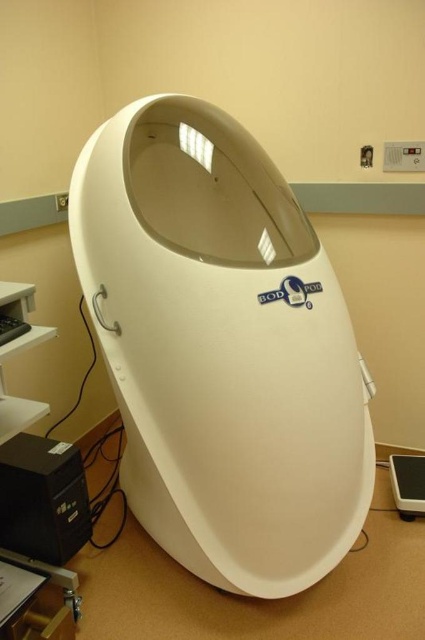
Question: Is white plastic pod at center behind black plastic mouse at lower left?

Choices:
 (A) no
 (B) yes

Answer: (B)

Question: Which point is farther from the camera taking this photo?

Choices:
 (A) (144, 508)
 (B) (0, 337)

Answer: (A)

Question: Can you confirm if white plastic pod at center is wider than black plastic tower at lower left?

Choices:
 (A) no
 (B) yes

Answer: (B)

Question: Does white plastic pod at center appear under black plastic tower at lower left?

Choices:
 (A) yes
 (B) no

Answer: (B)

Question: Based on their relative distances, which object is nearer to the white plastic scale at lower right?

Choices:
 (A) white plastic pod at center
 (B) black plastic mouse at lower left
 (C) black plastic tower at lower left

Answer: (A)

Question: Considering the real-world distances, which object is farthest from the black plastic mouse at lower left?

Choices:
 (A) black plastic tower at lower left
 (B) white plastic scale at lower right
 (C) white plastic pod at center

Answer: (B)